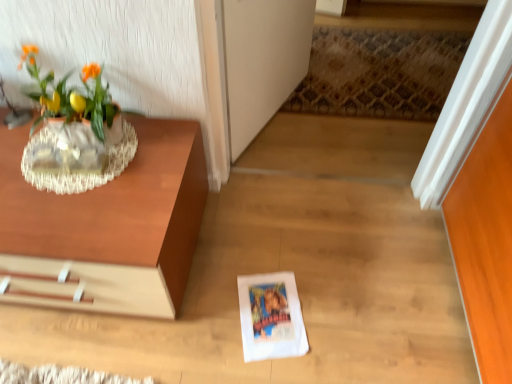
At what (x,y) coordinates should I click in order to perform the action: click on blank space situated above wooden table at left (from a real-world perspective). Please return your answer as a coordinate pair (x, y). Image resolution: width=512 pixels, height=384 pixels. Looking at the image, I should click on (69, 185).